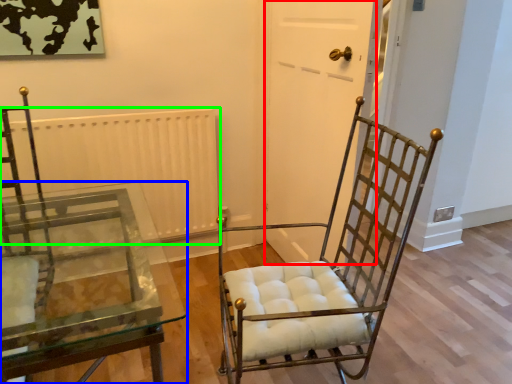
Question: Which is farther away from glass door (highlighted by a red box)? table (highlighted by a blue box) or radiator (highlighted by a green box)?

Choices:
 (A) table
 (B) radiator

Answer: (A)